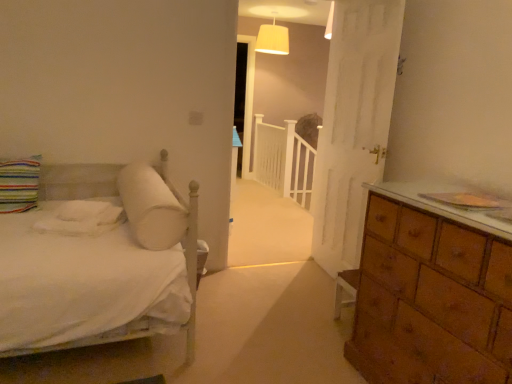
Question: Does white fabric lampshade at upper center come in front of striped fabric pillow at left, marked as the 1th pillow in a left-to-right arrangement?

Choices:
 (A) no
 (B) yes

Answer: (A)

Question: From the image's perspective, is white fabric lampshade at upper center under striped fabric pillow at left, which ranks as the 2th pillow in right-to-left order?

Choices:
 (A) yes
 (B) no

Answer: (B)

Question: Is white fabric lampshade at upper center not inside striped fabric pillow at left, marked as the 1th pillow in a left-to-right arrangement?

Choices:
 (A) no
 (B) yes

Answer: (B)

Question: Is striped fabric pillow at left, which ranks as the 2th pillow in right-to-left order, at the back of white fabric lampshade at upper center?

Choices:
 (A) yes
 (B) no

Answer: (B)

Question: Is white fabric lampshade at upper center taller than striped fabric pillow at left, marked as the 1th pillow in a left-to-right arrangement?

Choices:
 (A) yes
 (B) no

Answer: (A)

Question: Can you confirm if white fabric lampshade at upper center is positioned to the right of striped fabric pillow at left, which ranks as the 2th pillow in right-to-left order?

Choices:
 (A) yes
 (B) no

Answer: (A)

Question: Is white fabric lampshade at upper center positioned with its back to white cotton sheet at left?

Choices:
 (A) no
 (B) yes

Answer: (A)

Question: From the image's perspective, does white fabric lampshade at upper center appear lower than white cotton sheet at left?

Choices:
 (A) yes
 (B) no

Answer: (B)

Question: Are white fabric lampshade at upper center and white cotton sheet at left beside each other?

Choices:
 (A) yes
 (B) no

Answer: (B)

Question: Is white cotton sheet at left inside white fabric lampshade at upper center?

Choices:
 (A) no
 (B) yes

Answer: (A)

Question: Is white fabric lampshade at upper center to the right of white cotton sheet at left from the viewer's perspective?

Choices:
 (A) yes
 (B) no

Answer: (A)

Question: Does white fabric lampshade at upper center have a lesser height compared to white cotton sheet at left?

Choices:
 (A) yes
 (B) no

Answer: (B)

Question: Considering the relative sizes of white cotton sheet at left and white soft pillow at upper left, marked as the 1th pillow in a right-to-left arrangement, in the image provided, is white cotton sheet at left shorter than white soft pillow at upper left, marked as the 1th pillow in a right-to-left arrangement,?

Choices:
 (A) yes
 (B) no

Answer: (A)